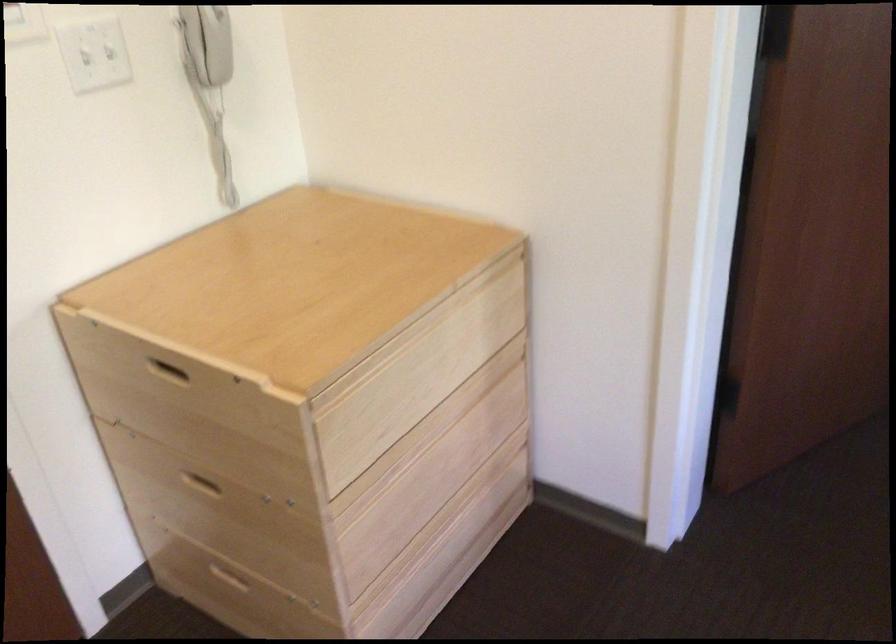
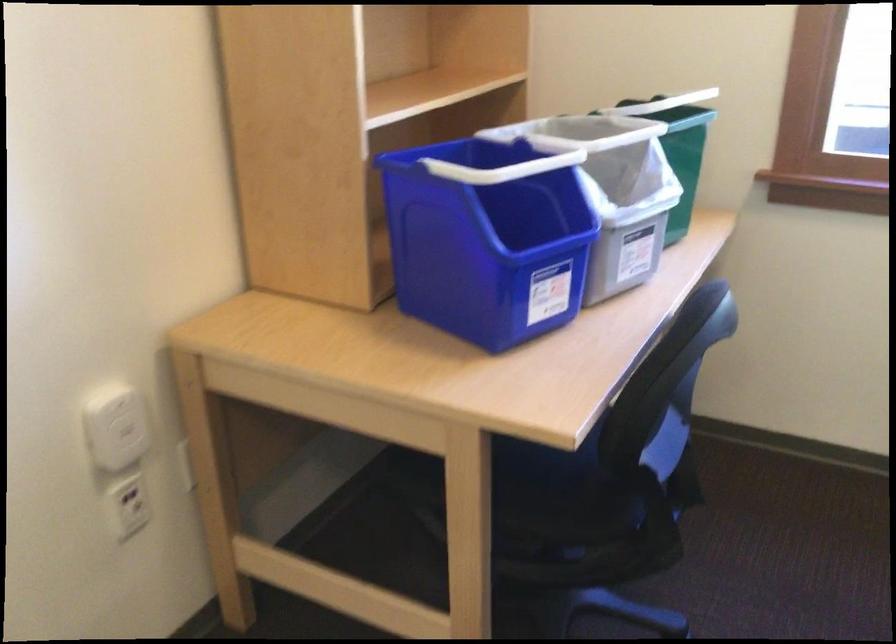
First-person continuous shooting, in which direction is the camera rotating?

The camera's rotation is toward right-down.